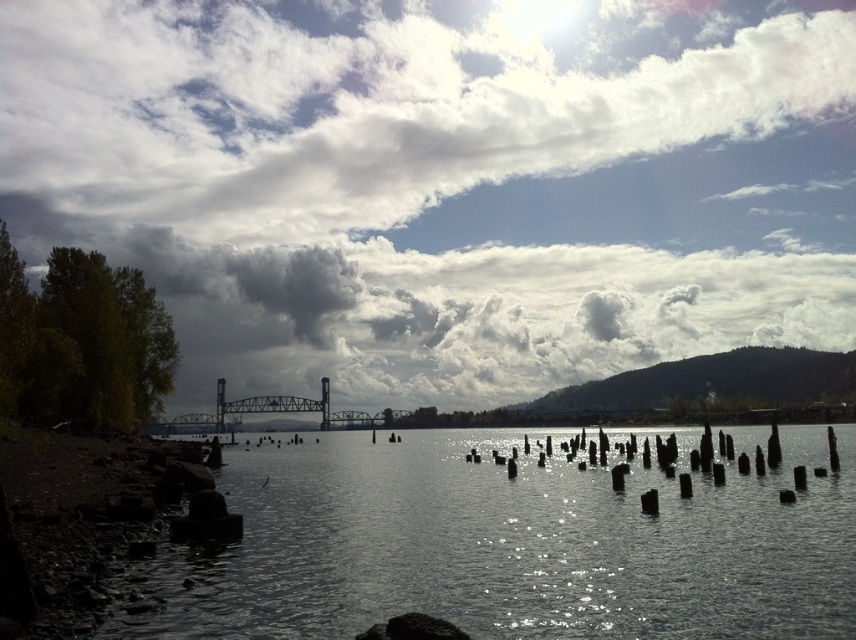
Question: Is cloudy sky at center further to the viewer compared to dark gray water at center?

Choices:
 (A) no
 (B) yes

Answer: (B)

Question: Does metallic bridge at center come in front of black metal pole at center?

Choices:
 (A) no
 (B) yes

Answer: (B)

Question: Which of these objects is positioned farthest from the black metal pole at center?

Choices:
 (A) dark gray water at center
 (B) metallic bridge at center
 (C) cloudy sky at center

Answer: (A)

Question: Does metallic bridge at center appear over black metal pole at center?

Choices:
 (A) no
 (B) yes

Answer: (A)

Question: Estimate the real-world distances between objects in this image. Which object is farther from the cloudy sky at center?

Choices:
 (A) black metal pole at center
 (B) metallic bridge at center

Answer: (A)

Question: Estimate the real-world distances between objects in this image. Which object is closer to the dark gray water at center?

Choices:
 (A) black metal pole at center
 (B) cloudy sky at center
 (C) metallic bridge at center

Answer: (B)